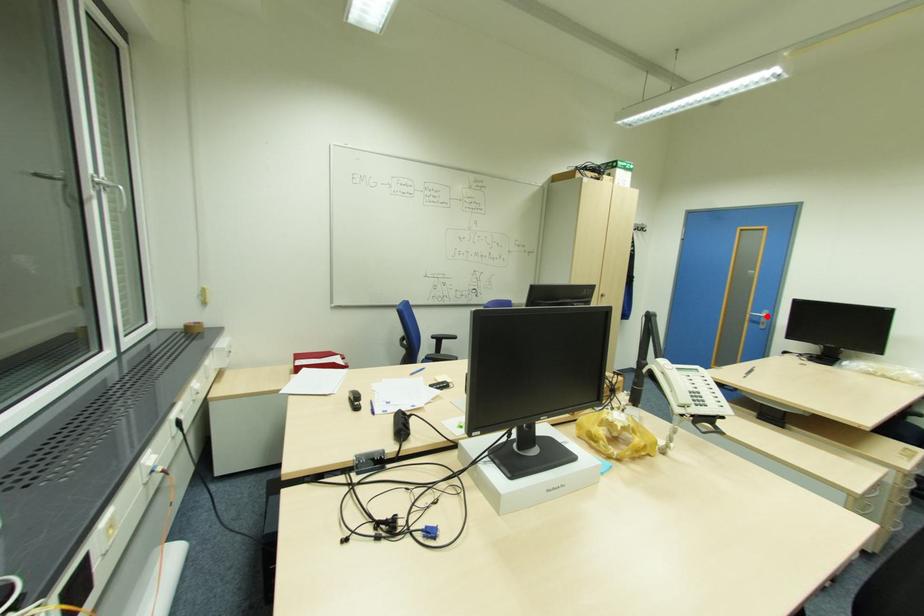
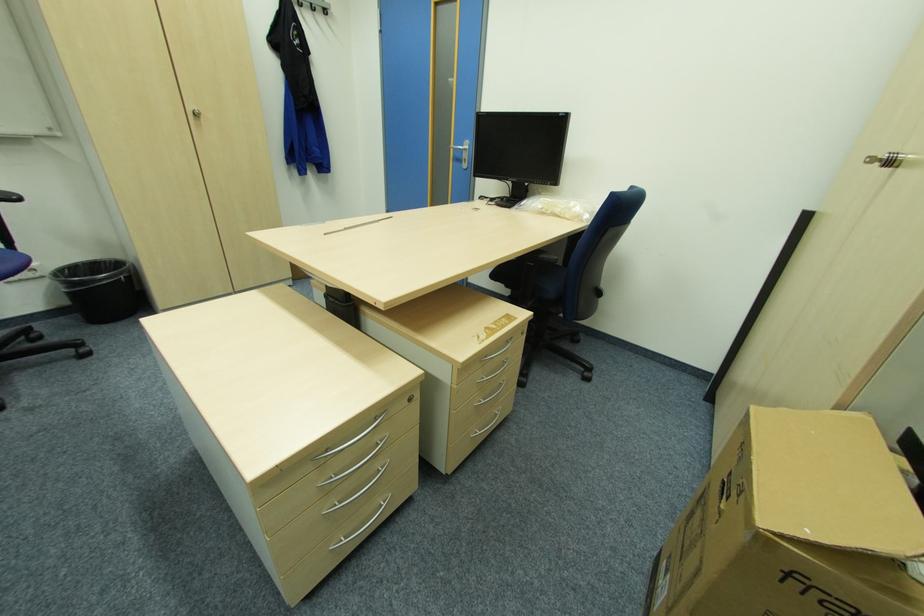
Locate, in the second image, the point that corresponds to the highlighted location in the first image.

(468, 148)